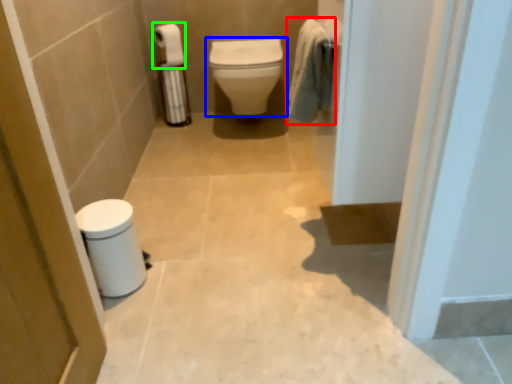
Question: Based on their relative distances, which object is farther from bath towel (highlighted by a red box)? Choose from toilet (highlighted by a blue box) and toilet paper (highlighted by a green box).

Choices:
 (A) toilet
 (B) toilet paper

Answer: (B)